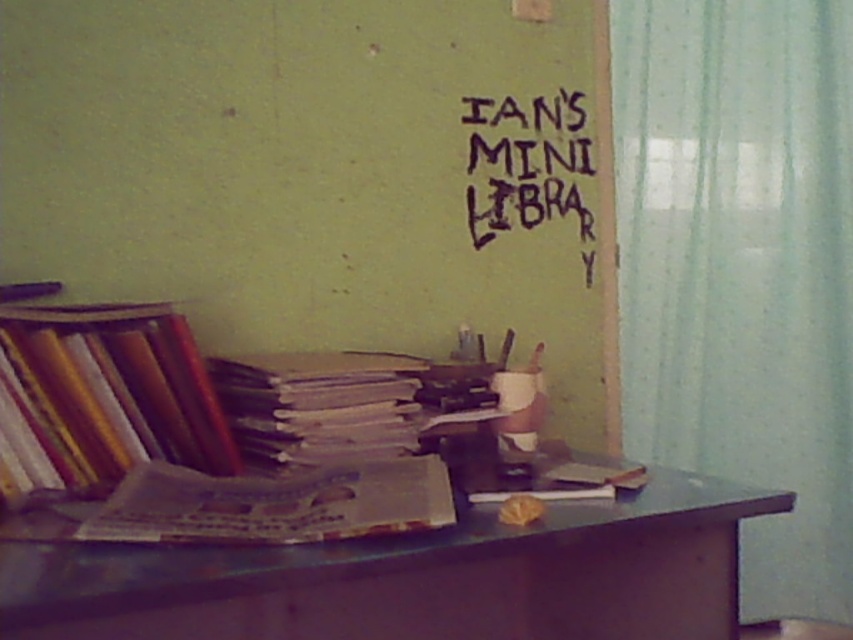
You are organizing a small event in this room and need to determine if the translucent fabric curtain at right can cover the matte paper books at left completely. Based on their widths, can the curtain cover the books?

The translucent fabric curtain at right might be wider than matte paper books at left, so there is a possibility it could cover them, but it is uncertain without precise measurements.

You are standing in the room and want to move from the point at coordinates point (805,481) to the point at coordinates point (108,580). Which direction should you move to get closer to your destination?

To move from point (805,481) to point (108,580), you should move towards the lower right direction since point (108,580) is located lower and to the right compared to point (805,481).

You are organizing books on a shelf and have two options. You have a stack of matte paper books at left and a single matte paper book at center. If you want to place them side by side, which one should you place first to ensure they fit properly?

The matte paper books at left are narrower than the matte paper book at center, so you should place the matte paper books at left first to accommodate the wider matte paper book at center.